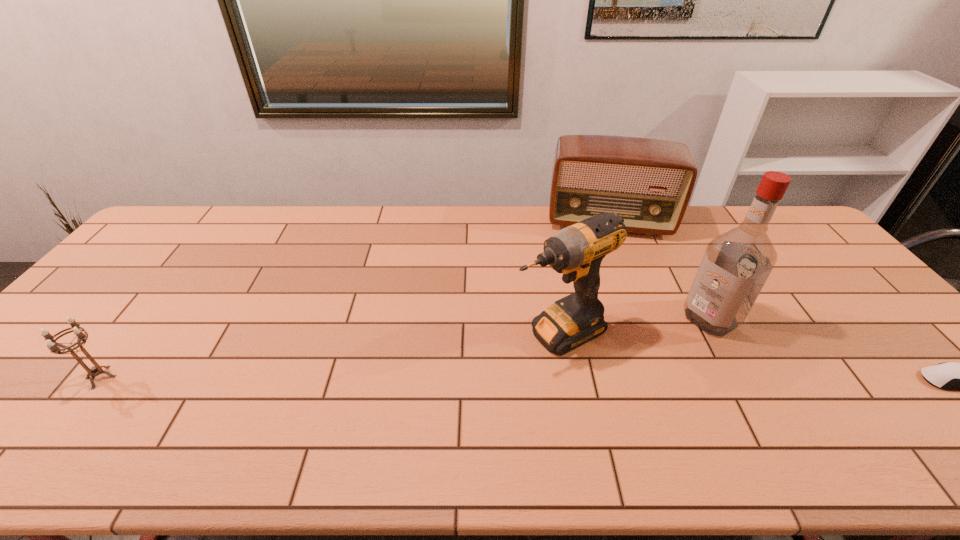
Identify the location of vacant area situated with the drill bit of the drill facing forward. (429, 392).

What are the coordinates of `vacant space located 0.180m with the drill bit of the drill facing forward` in the screenshot? It's located at (459, 376).

Locate an element on the screen. vacant region located 0.360m with the drill bit of the drill facing forward is located at coordinates (389, 412).

Where is `free space located 0.120m on the front-facing side of the tallest object`? Image resolution: width=960 pixels, height=540 pixels. free space located 0.120m on the front-facing side of the tallest object is located at coordinates (663, 348).

You are a GUI agent. You are given a task and a screenshot of the screen. Output one action in this format:
    pyautogui.click(x=<x>, y=<y>)
    Task: Click on the vacant space located 0.200m on the front-facing side of the tallest object
    
    Given the screenshot: What is the action you would take?
    pyautogui.click(x=641, y=361)

Identify the location of free region located 0.070m on the front-facing side of the tallest object. This screenshot has height=540, width=960. (676, 340).

Find the location of a particular element. object at the far edge is located at coordinates (648, 182).

Where is `object that is positioned at the near edge`? Image resolution: width=960 pixels, height=540 pixels. object that is positioned at the near edge is located at coordinates (54, 347).

The width and height of the screenshot is (960, 540). Find the location of `object at the left edge`. object at the left edge is located at coordinates pos(54,347).

This screenshot has width=960, height=540. I want to click on object that is at the near left corner, so click(x=54, y=347).